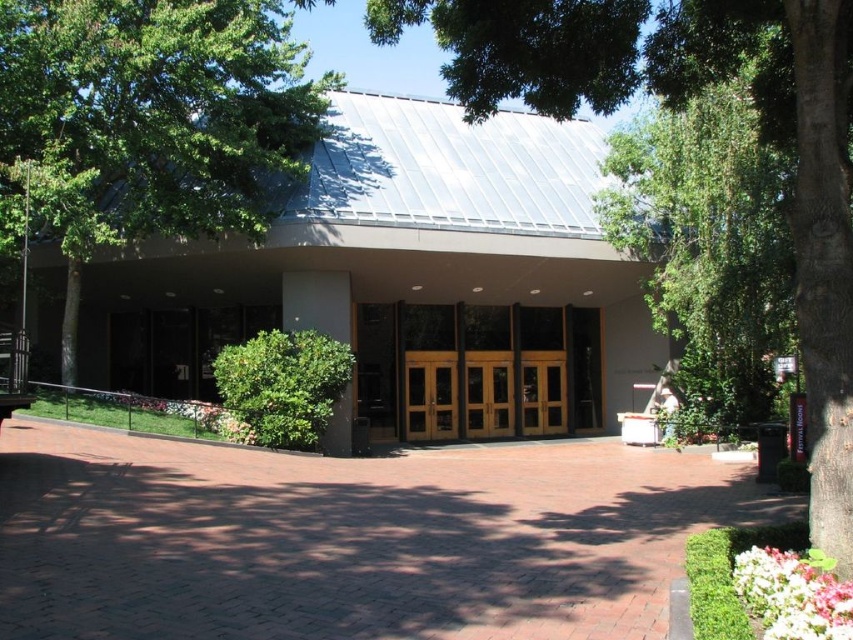
You are a landscape architect designing a pathway between the green leafy tree at upper left and the green leafy tree at center. Which tree should the pathway be closer to to avoid blocking sunlight for the shorter tree?

The pathway should be closer to the green leafy tree at center since it is shorter, ensuring sunlight reaches it without obstruction from the taller green leafy tree at upper left.

You are standing at the entrance of the modern building and want to plant a new tree in the paved area. Given the location of the green leafy tree at upper left, where should you avoid placing the new tree to prevent overcrowding?

You should avoid placing the new tree near the green leafy tree at upper left, which is located at point (149, 124), to prevent overcrowding.